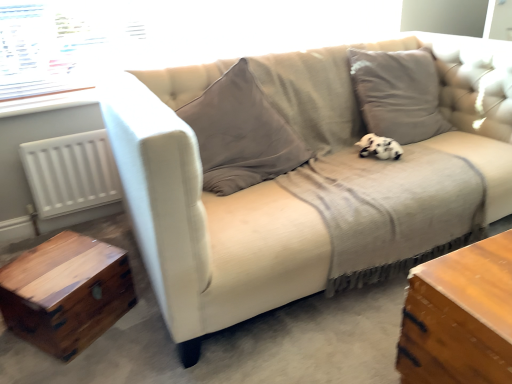
This screenshot has width=512, height=384. I want to click on free spot in front of wooden trunk at lower left, so click(x=59, y=362).